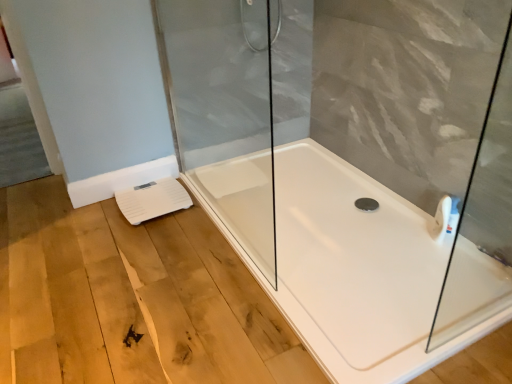
Question: From a real-world perspective, is transparent glass shower door at center above or below white glossy bathtub at center?

Choices:
 (A) above
 (B) below

Answer: (A)

Question: From the image's perspective, is transparent glass shower door at center positioned above or below white glossy bathtub at center?

Choices:
 (A) above
 (B) below

Answer: (A)

Question: Considering the real-world distances, which object is farthest from the white plastic scale at lower left?

Choices:
 (A) white glossy bathtub at center
 (B) transparent glass shower door at center

Answer: (A)

Question: Based on their relative distances, which object is farther from the white glossy bathtub at center?

Choices:
 (A) white plastic scale at lower left
 (B) transparent glass shower door at center

Answer: (B)